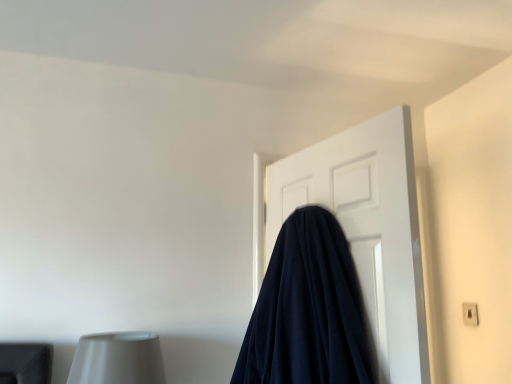
Question: Is navy blue fabric at center wider or thinner than white plastic electric outlet at upper right?

Choices:
 (A) wide
 (B) thin

Answer: (A)

Question: From the image's perspective, is navy blue fabric at center above or below white plastic electric outlet at upper right?

Choices:
 (A) below
 (B) above

Answer: (B)

Question: Considering the real-world distances, which object is closest to the navy blue fabric at center?

Choices:
 (A) white plastic electric outlet at upper right
 (B) navy blue fabric at center

Answer: (B)

Question: Which object is positioned farthest from the navy blue fabric at center?

Choices:
 (A) white plastic electric outlet at upper right
 (B) navy blue fabric at center

Answer: (A)